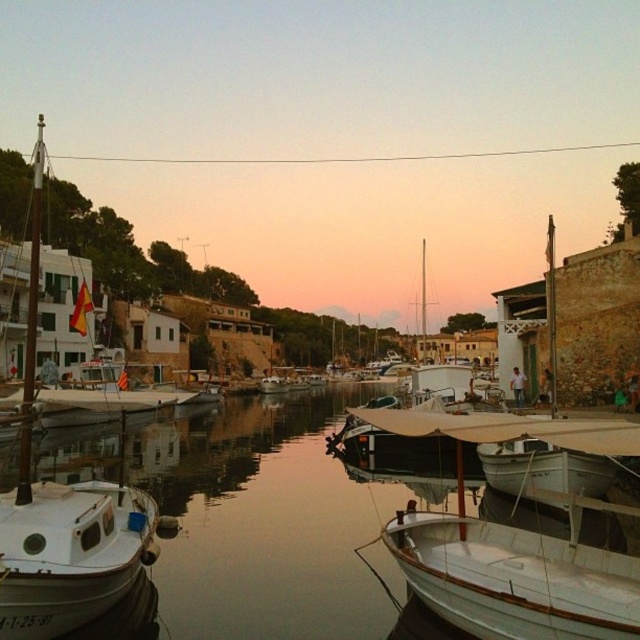
Does smooth water at center lie behind white matte sailboat at center?

No, it is not.

Measure the distance between smooth water at center and white matte sailboat at center.

smooth water at center is 75.52 feet from white matte sailboat at center.

Is point (316, 625) positioned in front of point (410, 406)?

Yes, point (316, 625) is in front of point (410, 406).

The image size is (640, 640). In order to click on smooth water at center in this screenshot , I will do `click(260, 524)`.

Can you confirm if smooth water at center is positioned below white matte boat at left?

Indeed, smooth water at center is positioned under white matte boat at left.

Is point (289, 477) positioned before point (42, 545)?

No.

Who is more forward, (336, 500) or (52, 621)?

Point (52, 621) is more forward.

This screenshot has height=640, width=640. In order to click on smooth water at center in this screenshot , I will do `click(260, 524)`.

Is white matte boat at right above white matte sailboat at center?

Actually, white matte boat at right is below white matte sailboat at center.

In the scene shown: Does white matte boat at right have a lesser width compared to white matte sailboat at center?

Yes.

At what (x,y) coordinates should I click in order to perform the action: click on white matte boat at right. Please return your answer as a coordinate pair (x, y). The height and width of the screenshot is (640, 640). Looking at the image, I should click on (572, 324).